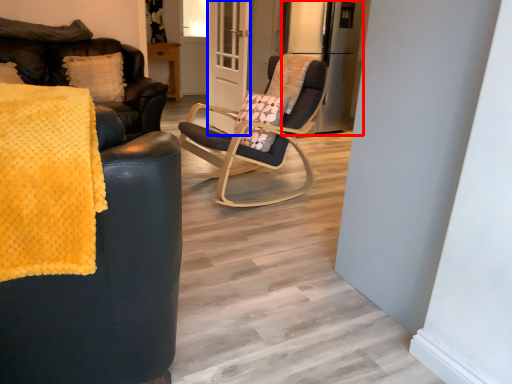
Question: Which object appears closest to the camera in this image, appliance (highlighted by a red box) or screen door (highlighted by a blue box)?

Choices:
 (A) appliance
 (B) screen door

Answer: (B)